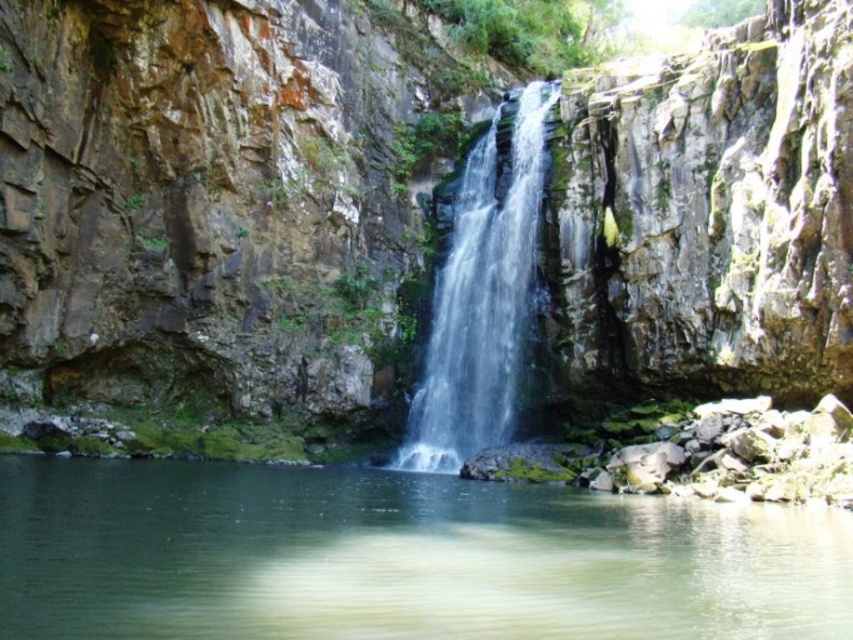
You are a hiker who wants to cross the pool at the center of the scene. You see the green mossy rock at center and the clear water at center. Which object would provide a more stable footing for walking?

The green mossy rock at center is bigger than the clear water at center, so it would provide a more stable footing for walking.

You are standing at the edge of the pool and want to place a small decorative stone on the closest object in the scene. Which object should you choose between the green mossy rock at center and the clear water at center?

The green mossy rock at center is closer to the viewer than the clear water at center, so you should place the decorative stone on the green mossy rock at center.

You are standing at the base of the waterfall and want to take a photo of the point at coordinates point (251, 252). Your camera has a maximum focus range of 85 meters. Will the camera be able to focus on that point?

The distance of point (251, 252) from the camera is 86.57 meters, which exceeds the camera maximum focus range of 85 meters. Therefore, the camera cannot focus on that point.